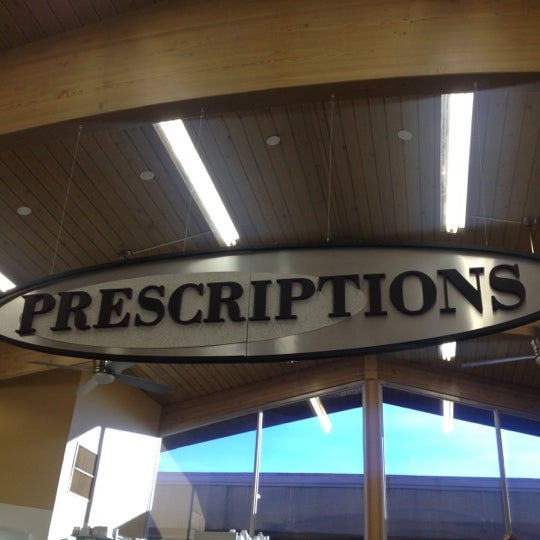
The image size is (540, 540). Find the location of `ductwork vent`. ductwork vent is located at coordinates (83, 462), (82, 483).